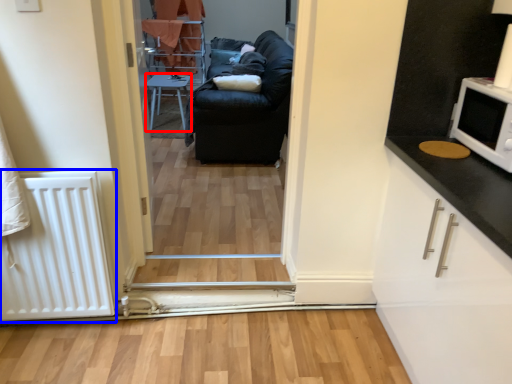
Question: Among these objects, which one is nearest to the camera, furniture (highlighted by a red box) or radiator (highlighted by a blue box)?

Choices:
 (A) furniture
 (B) radiator

Answer: (B)